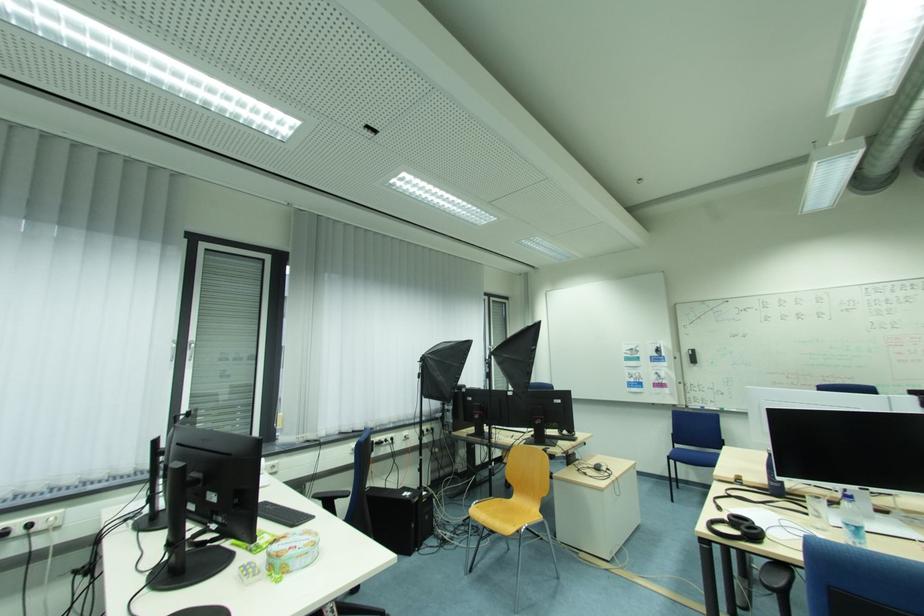
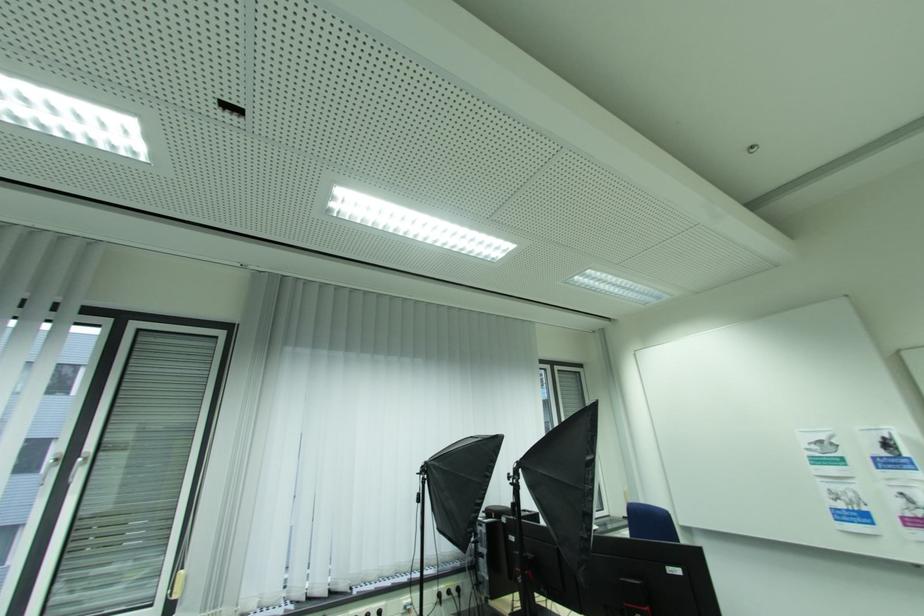
In a continuous first-person perspective shot, in which direction is the camera moving?

The cameraman moved toward right, forward.